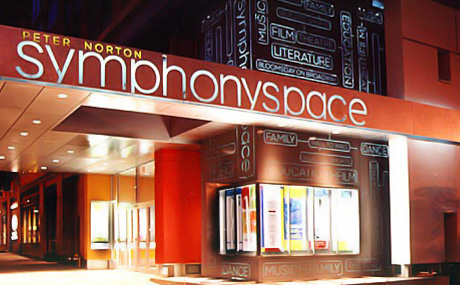
Where is `hotel`? The image size is (460, 285). hotel is located at coordinates (123, 219).